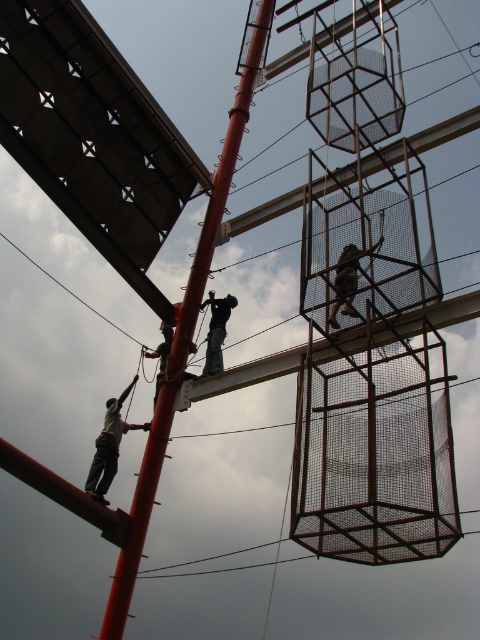
Question: Which point is closer to the camera?

Choices:
 (A) green fabric rope at left
 (B) yellow safety harness at center
 (C) dark blue jeans at center

Answer: (B)

Question: Which of these objects is positioned farthest from the green fabric rope at left?

Choices:
 (A) dark blue jeans at center
 (B) yellow safety harness at center
 (C) smooth red pole at center

Answer: (B)

Question: Does yellow safety harness at center appear on the left side of dark blue jeans at center?

Choices:
 (A) yes
 (B) no

Answer: (B)

Question: Which point is farther to the camera?

Choices:
 (A) dark blue jeans at center
 (B) smooth red pole at center
 (C) yellow safety harness at center
 (D) green fabric rope at left

Answer: (A)

Question: Does smooth red pole at center have a larger size compared to green fabric rope at left?

Choices:
 (A) no
 (B) yes

Answer: (B)

Question: Is smooth red pole at center bigger than dark blue jeans at center?

Choices:
 (A) yes
 (B) no

Answer: (A)